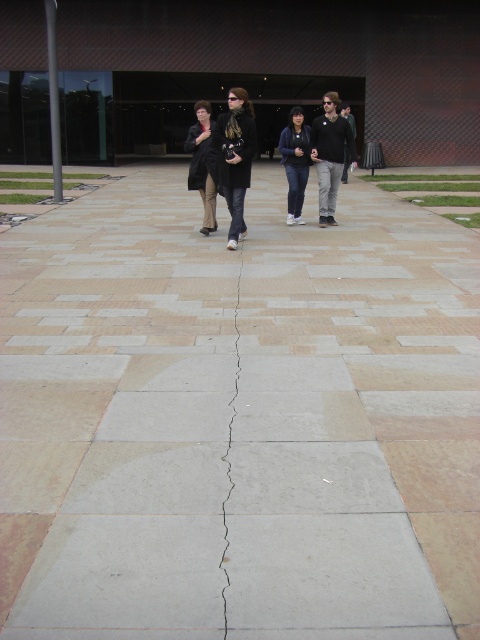
Is point (445, 579) behind point (233, 157)?

That is False.

Between point (370, 392) and point (230, 189), which one is positioned in front?

Positioned in front is point (370, 392).

Does point (24, 400) come farther from viewer compared to point (251, 148)?

No, it is not.

Where is `smooth stone pavement at center`? smooth stone pavement at center is located at coordinates (239, 419).

Which is below, dark blue jeans at center or cracked concrete at center?

cracked concrete at center

The height and width of the screenshot is (640, 480). Identify the location of dark blue jeans at center. (296, 161).

At what (x,y) coordinates should I click in order to perform the action: click on dark blue jeans at center. Please return your answer as a coordinate pair (x, y). Looking at the image, I should click on (296, 161).

Does dark gray sweater at center have a lesser height compared to cracked concrete at center?

No, dark gray sweater at center is not shorter than cracked concrete at center.

What do you see at coordinates (330, 154) in the screenshot? I see `dark gray sweater at center` at bounding box center [330, 154].

Locate an element on the screen. dark gray sweater at center is located at coordinates (330, 154).